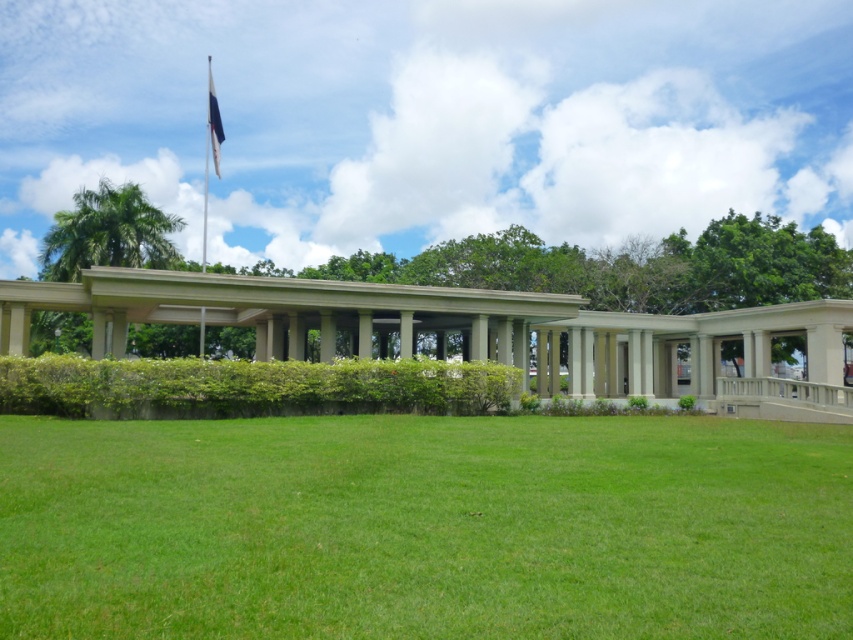
You are standing in the middle of the grassy area and want to take a photo of both the point at coordinates (128, 582) and the point at coordinates (210, 83). Which point should you focus on first to ensure both are in focus?

You should focus on the point at coordinates (128, 582) first because it is closer to the camera than the point at coordinates (210, 83). This ensures that both points will be in focus as the closer point sets the focal plane.